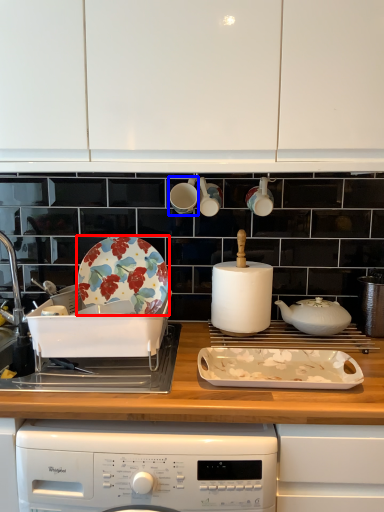
Question: Among these objects, which one is nearest to the camera, plate (highlighted by a red box) or appliance (highlighted by a blue box)?

Choices:
 (A) plate
 (B) appliance

Answer: (A)